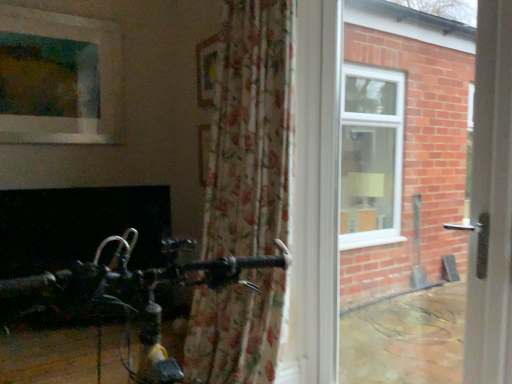
Question: Considering the relative sizes of floral fabric curtain at center and wooden frame at upper center in the image provided, is floral fabric curtain at center taller than wooden frame at upper center?

Choices:
 (A) no
 (B) yes

Answer: (B)

Question: Can you confirm if floral fabric curtain at center is positioned to the right of wooden frame at upper center?

Choices:
 (A) yes
 (B) no

Answer: (A)

Question: From the image's perspective, is floral fabric curtain at center on top of wooden frame at upper center?

Choices:
 (A) no
 (B) yes

Answer: (A)

Question: Are floral fabric curtain at center and wooden frame at upper center making contact?

Choices:
 (A) yes
 (B) no

Answer: (B)

Question: Considering the relative positions of floral fabric curtain at center and wooden frame at upper center in the image provided, is floral fabric curtain at center in front of wooden frame at upper center?

Choices:
 (A) yes
 (B) no

Answer: (A)

Question: Is floral fabric curtain at center shorter than wooden frame at upper center?

Choices:
 (A) no
 (B) yes

Answer: (A)

Question: Is matte glass window at upper left facing towards wooden frame at upper center?

Choices:
 (A) yes
 (B) no

Answer: (B)

Question: Is matte glass window at upper left completely or partially outside of wooden frame at upper center?

Choices:
 (A) yes
 (B) no

Answer: (A)

Question: Considering the relative sizes of matte glass window at upper left and wooden frame at upper center in the image provided, is matte glass window at upper left bigger than wooden frame at upper center?

Choices:
 (A) no
 (B) yes

Answer: (B)

Question: Are matte glass window at upper left and wooden frame at upper center far apart?

Choices:
 (A) yes
 (B) no

Answer: (B)

Question: Is matte glass window at upper left oriented away from wooden frame at upper center?

Choices:
 (A) no
 (B) yes

Answer: (A)

Question: Is the surface of matte glass window at upper left in direct contact with wooden frame at upper center?

Choices:
 (A) yes
 (B) no

Answer: (B)

Question: Considering the relative sizes of white plastic door handle at right and wooden frame at upper center in the image provided, is white plastic door handle at right bigger than wooden frame at upper center?

Choices:
 (A) yes
 (B) no

Answer: (A)